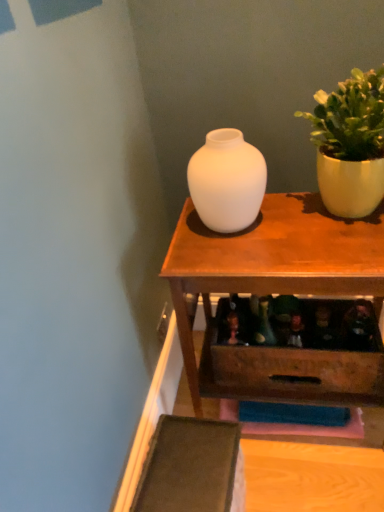
Question: From a real-world perspective, is matte wood table at center located beneath white matte vase at center?

Choices:
 (A) no
 (B) yes

Answer: (B)

Question: Is matte wood table at center taller than white matte vase at center?

Choices:
 (A) no
 (B) yes

Answer: (B)

Question: Is matte wood table at center smaller than white matte vase at center?

Choices:
 (A) no
 (B) yes

Answer: (A)

Question: Is matte wood table at center positioned with its back to white matte vase at center?

Choices:
 (A) yes
 (B) no

Answer: (B)

Question: From the image's perspective, is matte wood table at center below white matte vase at center?

Choices:
 (A) yes
 (B) no

Answer: (A)

Question: Are matte wood table at center and white matte vase at center making contact?

Choices:
 (A) no
 (B) yes

Answer: (A)

Question: Is white matte vase at center outside matte yellow pot at upper right?

Choices:
 (A) yes
 (B) no

Answer: (A)

Question: Can you confirm if white matte vase at center is thinner than matte yellow pot at upper right?

Choices:
 (A) no
 (B) yes

Answer: (B)

Question: Considering the relative sizes of white matte vase at center and matte yellow pot at upper right in the image provided, is white matte vase at center smaller than matte yellow pot at upper right?

Choices:
 (A) no
 (B) yes

Answer: (B)

Question: Can matte yellow pot at upper right be found inside white matte vase at center?

Choices:
 (A) yes
 (B) no

Answer: (B)

Question: Is white matte vase at center to the right of matte yellow pot at upper right from the viewer's perspective?

Choices:
 (A) yes
 (B) no

Answer: (B)

Question: Can you confirm if white matte vase at center is taller than matte yellow pot at upper right?

Choices:
 (A) yes
 (B) no

Answer: (B)

Question: Is matte wood table at center oriented towards matte yellow pot at upper right?

Choices:
 (A) yes
 (B) no

Answer: (B)